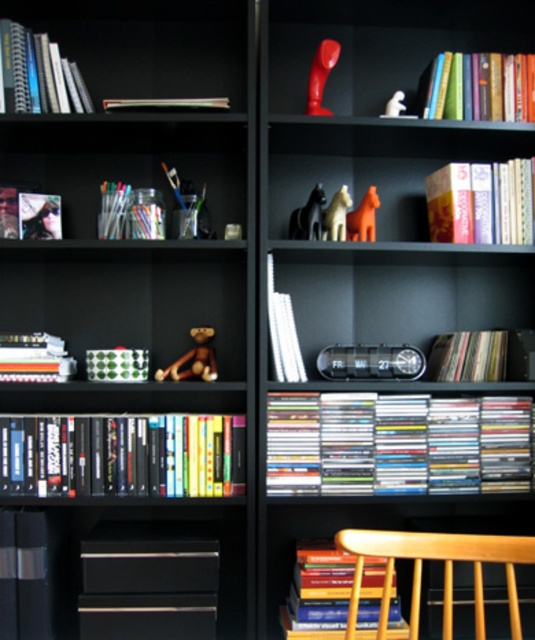
Can you confirm if hardcover book at lower center is shorter than multicolored paper at center?

No.

Can you confirm if hardcover book at lower center is positioned above multicolored paper at center?

Incorrect, hardcover book at lower center is not positioned above multicolored paper at center.

Which is behind, point (384, 579) or point (445, 358)?

Point (445, 358)

You are a GUI agent. You are given a task and a screenshot of the screen. Output one action in this format:
    pyautogui.click(x=<x>, y=<y>)
    Task: Click on the hardcover book at lower center
    The image size is (535, 640).
    Given the screenshot: What is the action you would take?
    pyautogui.click(x=317, y=593)

Between matte black photo frame at upper left and matte orange horse at upper right, which one is positioned lower?

Positioned lower is matte black photo frame at upper left.

Who is taller, matte black photo frame at upper left or matte orange horse at upper right?

With more height is matte orange horse at upper right.

Does point (21, 196) come farther from viewer compared to point (378, 204)?

Yes, it is.

Find the location of a particular element. This screenshot has width=535, height=640. matte black photo frame at upper left is located at coordinates (28, 214).

Which is more to the right, matte red phone at upper center or brown plush bear at center?

From the viewer's perspective, matte red phone at upper center appears more on the right side.

Between point (465, 45) and point (203, 337), which one is positioned in front?

Point (203, 337)

Identify the location of matte red phone at upper center. (407, 54).

Identify the location of matte red phone at upper center. The height and width of the screenshot is (640, 535). (407, 54).